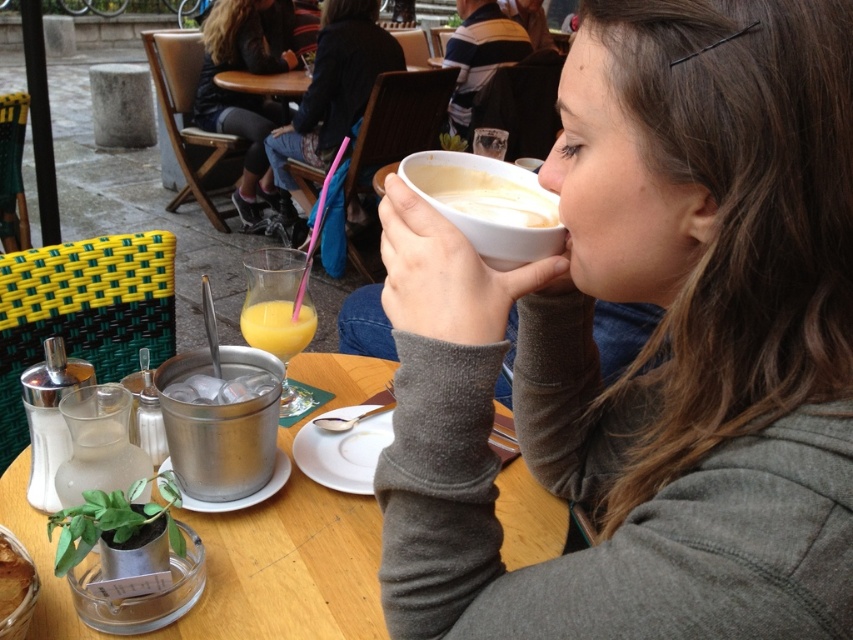
You are standing at the outdoor cafe table and want to place a napkin between the two points, point [352,589] and point [358,90]. Which point should the napkin be closer to to be centered between them?

The napkin should be placed closer to point [358,90] because point [352,589] is in front of it, meaning the distance between them requires the napkin to be nearer to the rear point for centering.

You are a barista at the outdoor cafe and need to place a new order for a customer. The customer wants their latte moved closer to the shiny metallic ice bucket at lower left. Where should you move the white creamy latte at upper center to?

You should move the white creamy latte at upper center to the left side of the shiny metallic ice bucket at lower left since the ice bucket is already positioned to the left of the latte.

You are at an outdoor cafe and want to place a small sugar container between the shiny metallic ice bucket at lower left and the translucent glass juice at center. Since the ice bucket is larger, will there be enough space between them to fit the container?

The shiny metallic ice bucket at lower left is larger than the translucent glass juice at center. Therefore, there should be sufficient space between them to place the small sugar container.